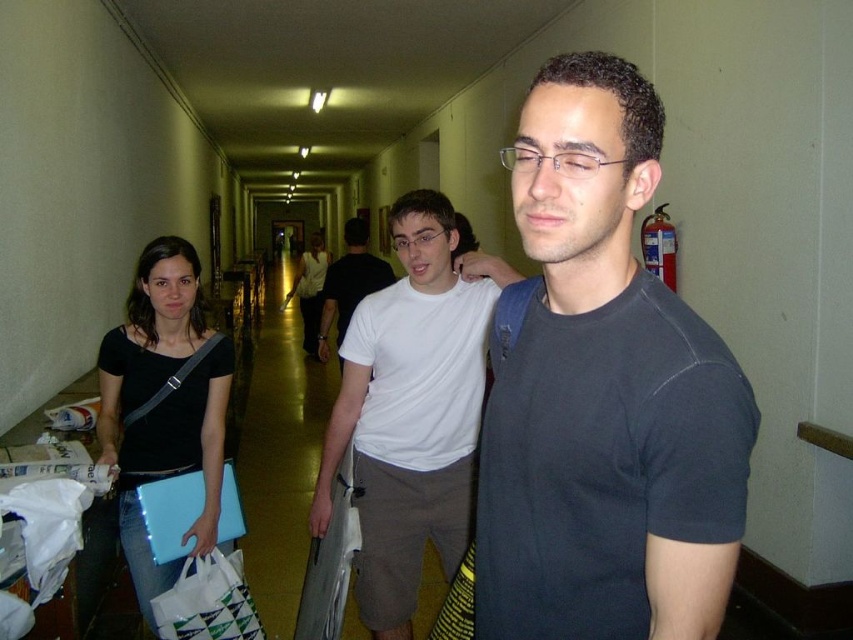
Consider the image. Which of these two, dark gray t-shirt at center or white fabric shopping bag at lower left, stands taller?

Standing taller between the two is dark gray t-shirt at center.

In the scene shown: Who is more distant from viewer, (579, 116) or (200, 557)?

The point (200, 557) is behind.

The height and width of the screenshot is (640, 853). I want to click on dark gray t-shirt at center, so click(602, 394).

Which is more to the left, dark gray t-shirt at center or white matte shirt at center?

Positioned to the left is white matte shirt at center.

This screenshot has width=853, height=640. Describe the element at coordinates (602, 394) in the screenshot. I see `dark gray t-shirt at center` at that location.

The height and width of the screenshot is (640, 853). What do you see at coordinates (602, 394) in the screenshot?
I see `dark gray t-shirt at center` at bounding box center [602, 394].

Find the location of a particular element. This screenshot has height=640, width=853. dark gray t-shirt at center is located at coordinates (602, 394).

Who is more distant from viewer, (456, 344) or (351, 232)?

Point (351, 232)

Is white cotton t-shirt at center to the left of white matte t-shirt at center from the viewer's perspective?

No, white cotton t-shirt at center is not to the left of white matte t-shirt at center.

Who is more forward, (369, 387) or (345, 324)?

Positioned in front is point (369, 387).

At what (x,y) coordinates should I click in order to perform the action: click on white cotton t-shirt at center. Please return your answer as a coordinate pair (x, y). This screenshot has width=853, height=640. Looking at the image, I should click on (412, 410).